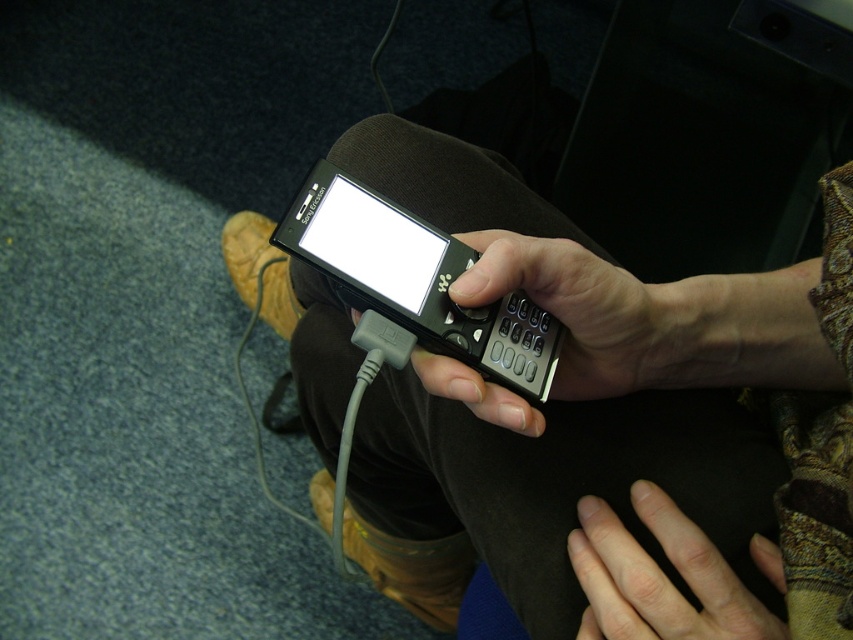
Question: Considering the relative positions of black plastic smartphone at center and smooth skin hand at lower center in the image provided, where is black plastic smartphone at center located with respect to smooth skin hand at lower center?

Choices:
 (A) above
 (B) below

Answer: (A)

Question: Estimate the real-world distances between objects in this image. Which object is closer to the black matte keypad at center?

Choices:
 (A) black plastic smartphone at center
 (B) black matte phone at center

Answer: (A)

Question: Which object is closer to the camera taking this photo?

Choices:
 (A) black matte keypad at center
 (B) bright glossy screen at center

Answer: (A)

Question: In this image, where is black plastic smartphone at center located relative to bright glossy screen at center?

Choices:
 (A) right
 (B) left

Answer: (A)

Question: Which object is farther from the camera taking this photo?

Choices:
 (A) bright glossy screen at center
 (B) black matte keypad at center
 (C) black plastic smartphone at center
 (D) smooth skin hand at lower center

Answer: (A)

Question: Is black matte phone at center smaller than black matte keypad at center?

Choices:
 (A) yes
 (B) no

Answer: (B)